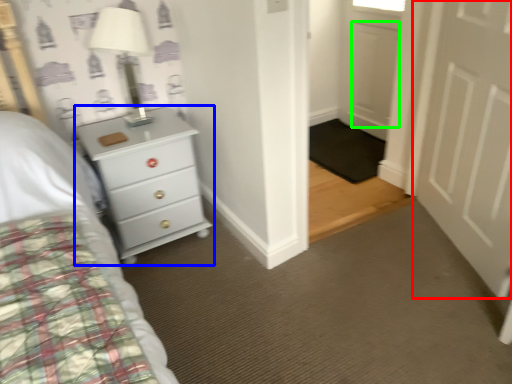
Question: Which object is the closest to the door (highlighted by a red box)? Choose among these: chest of drawers (highlighted by a blue box) or door (highlighted by a green box).

Choices:
 (A) chest of drawers
 (B) door

Answer: (B)